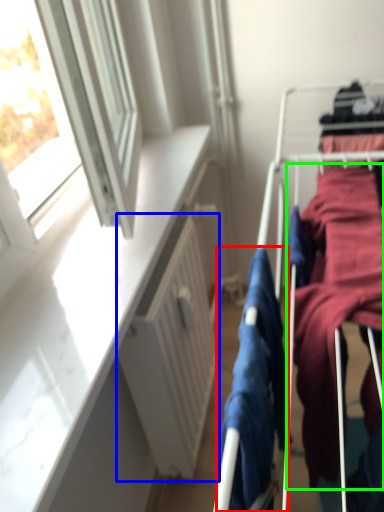
Question: Which object is the closest to the clothing (highlighted by a red box)? Choose among these: radiator (highlighted by a blue box) or clothing (highlighted by a green box).

Choices:
 (A) radiator
 (B) clothing

Answer: (B)